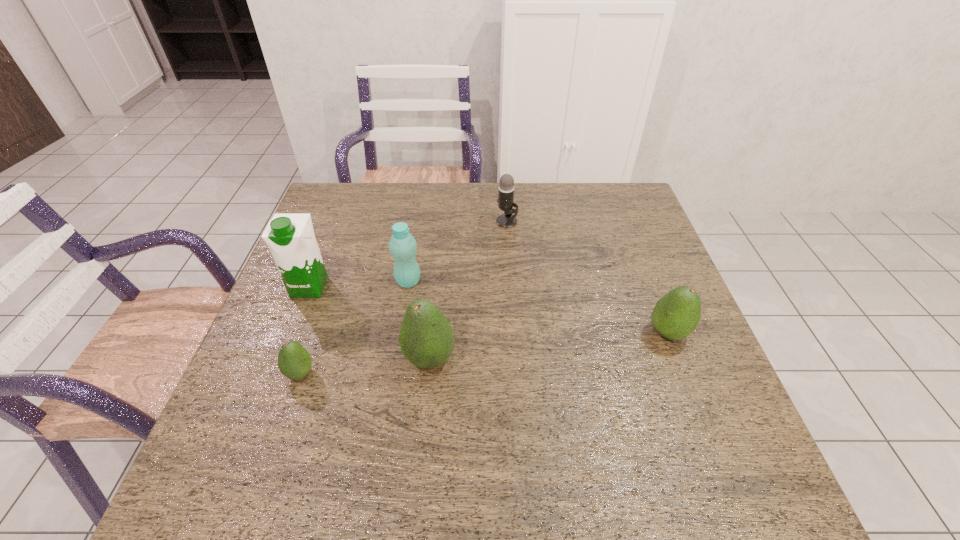
Where is `vacant region between the rightmost avocado and the shortest object`? vacant region between the rightmost avocado and the shortest object is located at coordinates (484, 353).

Locate an element on the screen. free space between the shortest object and the second avocado from left to right is located at coordinates (365, 366).

Identify which object is located as the nearest to the tallest object. Please provide its 2D coordinates. Your answer should be formatted as a tuple, i.e. [(x, y)], where the tuple contains the x and y coordinates of a point satisfying the conditions above.

[(402, 245)]

The image size is (960, 540). In order to click on object that is the second closest to the bottle in this screenshot , I will do `click(290, 237)`.

Choose which avocado is the second nearest neighbor to the farthest object. Please provide its 2D coordinates. Your answer should be formatted as a tuple, i.e. [(x, y)], where the tuple contains the x and y coordinates of a point satisfying the conditions above.

[(676, 315)]

The height and width of the screenshot is (540, 960). Identify the location of avocado that is the second closest one to the second avocado from left to right. (676, 315).

Image resolution: width=960 pixels, height=540 pixels. Identify the location of vacant region that satisfies the following two spatial constraints: 1. on the front-facing side of the rightmost avocado; 2. on the right side of the tallest object. (292, 333).

Identify the location of free location that satisfies the following two spatial constraints: 1. on the back side of the bottle; 2. on the left side of the fifth object from left to right. This screenshot has height=540, width=960. (419, 221).

Find the location of `free spot that satisfies the following two spatial constraints: 1. on the back side of the bottle; 2. on the right side of the shortest avocado`. free spot that satisfies the following two spatial constraints: 1. on the back side of the bottle; 2. on the right side of the shortest avocado is located at coordinates (332, 281).

You are a GUI agent. You are given a task and a screenshot of the screen. Output one action in this format:
    pyautogui.click(x=<x>, y=<y>)
    Task: Click on the vacant space that satisfies the following two spatial constraints: 1. on the back side of the rightmost object; 2. on the left side of the second avocado from right to left
    The image size is (960, 540).
    Given the screenshot: What is the action you would take?
    pyautogui.click(x=432, y=333)